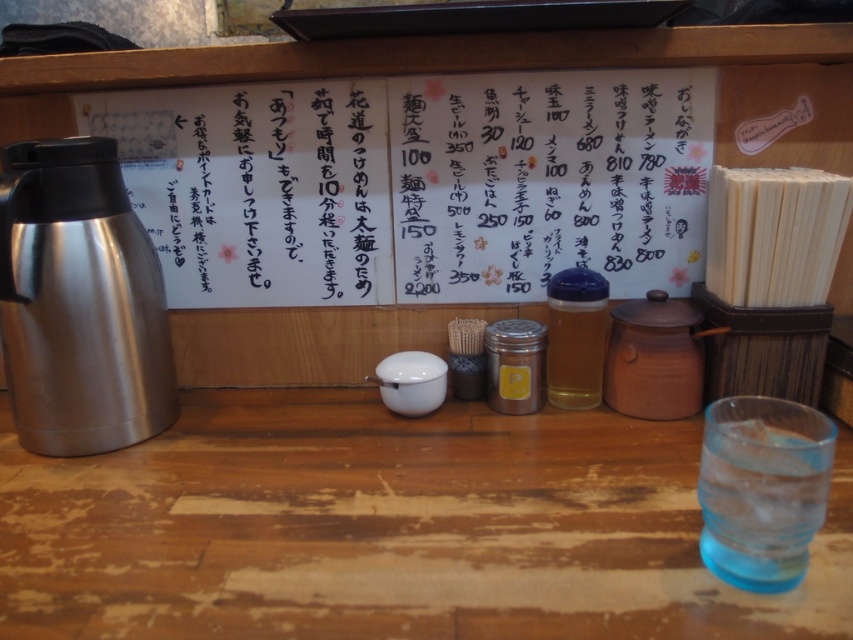
You are a customer at the counter and want to place your phone on the shiny metallic thermos at left. Is the thermos located at the far left end of the counter?

The shiny metallic thermos at left is located at point (79, 301), which is not the far left end of the counter. Please place your phone elsewhere to avoid it falling off the edge.

From the picture: You are a customer at the counter and want to place your phone on the white paper at center. However, the shiny metallic thermos at left is in the way. Can you move the thermos to the right to make space?

The white paper at center is positioned over the shiny metallic thermos at left, meaning the thermos is underneath the paper. To make space, you can move the thermos to the right since it is currently beneath the paper.